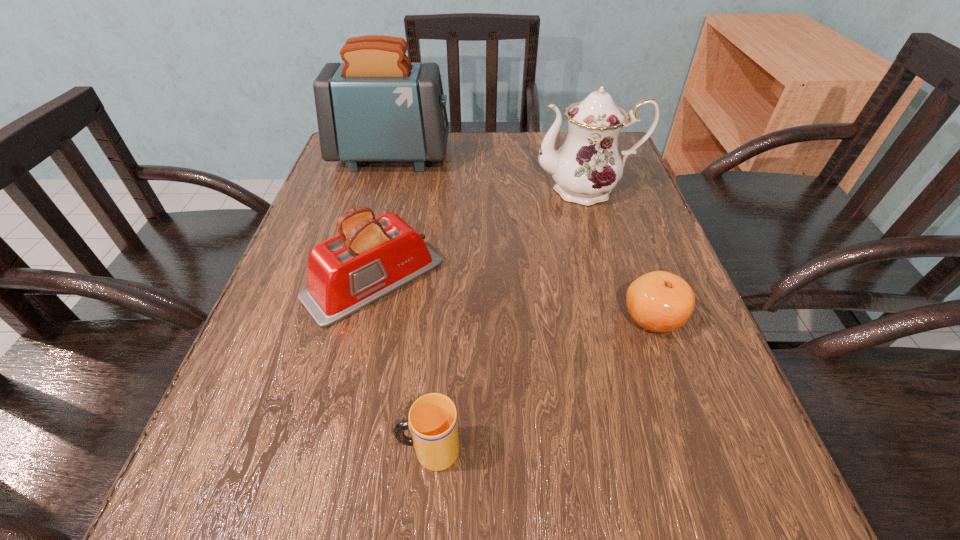
This screenshot has height=540, width=960. Identify the location of free space between the nearest object and the shorter toaster. (401, 365).

Where is `vacant point located between the clementine and the nearer toaster`? vacant point located between the clementine and the nearer toaster is located at coordinates (514, 299).

Locate an element on the screen. free space between the chinaware and the farther toaster is located at coordinates (489, 173).

This screenshot has height=540, width=960. What are the coordinates of `free point between the fourth shortest object and the nearest object` in the screenshot? It's located at (508, 320).

What are the coordinates of `empty space between the farther toaster and the nearest object` in the screenshot? It's located at (410, 303).

Find the location of `empty space that is in between the chinaware and the nearest object`. empty space that is in between the chinaware and the nearest object is located at coordinates (508, 320).

The width and height of the screenshot is (960, 540). I want to click on free area in between the cup and the farther toaster, so click(410, 303).

Locate an element on the screen. free space between the shorter toaster and the nearest object is located at coordinates (401, 365).

Locate an element on the screen. unoccupied position between the clementine and the chinaware is located at coordinates point(620,253).

Choose which object is the nearest neighbor to the second tallest object. Please provide its 2D coordinates. Your answer should be formatted as a tuple, i.e. [(x, y)], where the tuple contains the x and y coordinates of a point satisfying the conditions above.

[(377, 106)]